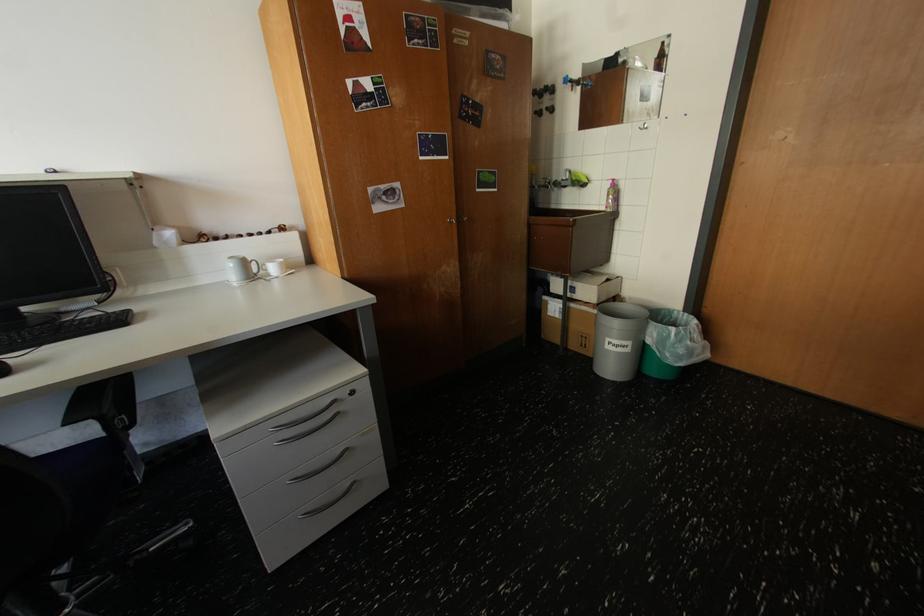
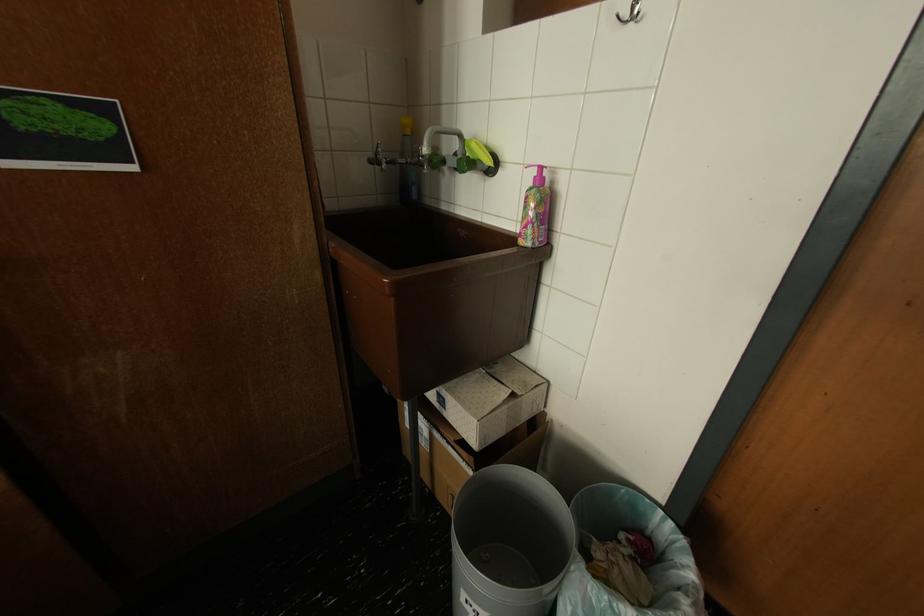
The images are taken continuously from a first-person perspective. In which direction are you moving?

The cameraman walked toward right, forward.